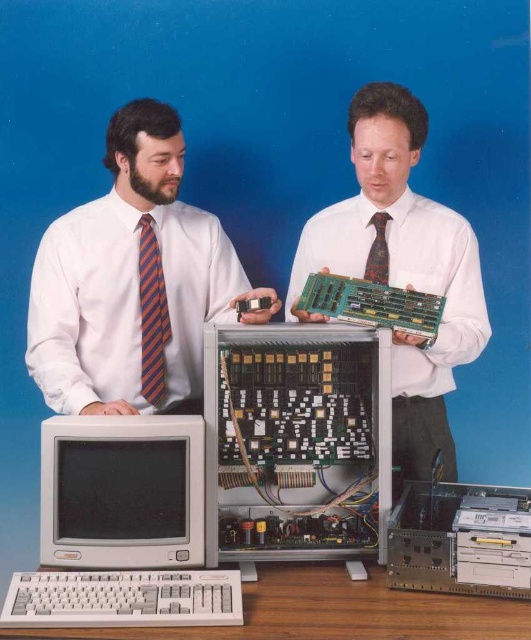
Question: Does silver metallic computer at center have a smaller size compared to matte gray monitor at lower left?

Choices:
 (A) yes
 (B) no

Answer: (B)

Question: Which object appears closest to the camera in this image?

Choices:
 (A) striped fabric tie at left
 (B) white shirt at left
 (C) multicolored woven tie at upper right

Answer: (B)

Question: Can you confirm if matte green circuit board at center is thinner than striped fabric tie at left?

Choices:
 (A) yes
 (B) no

Answer: (B)

Question: Can you confirm if striped fabric tie at left is thinner than multicolored woven tie at upper right?

Choices:
 (A) no
 (B) yes

Answer: (A)

Question: Which point appears farthest from the camera in this image?

Choices:
 (A) (244, 515)
 (B) (142, 372)

Answer: (B)

Question: Which point appears farthest from the camera in this image?

Choices:
 (A) (398, 346)
 (B) (372, 243)

Answer: (B)